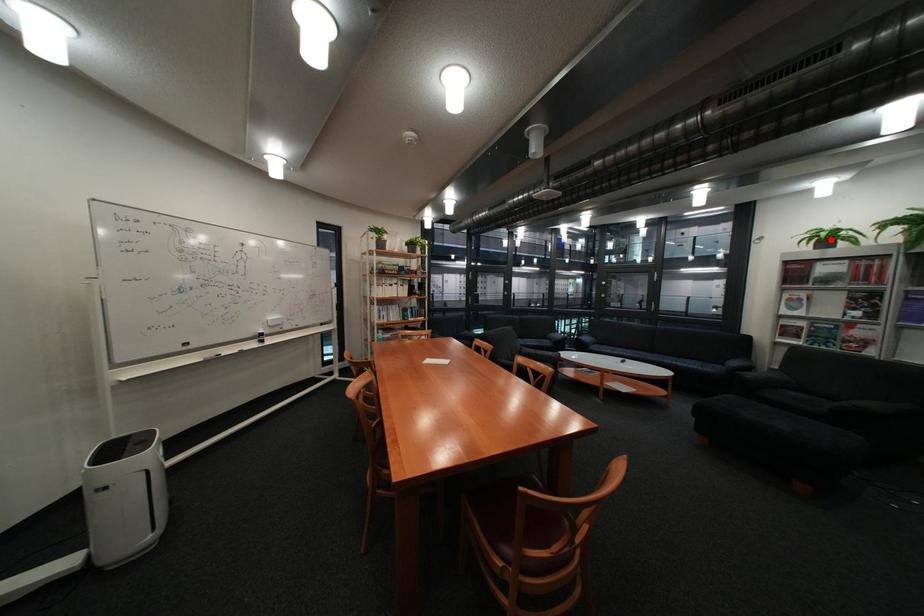
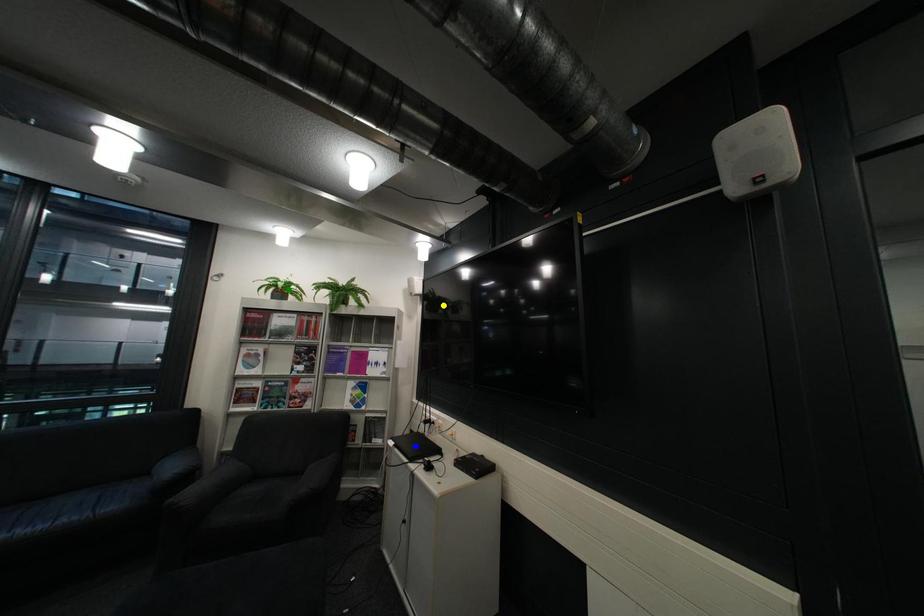
Question: I am providing you with two images of the same scene from different viewpoints. A red point is marked on the first image. You are given multiple points on the second image. Can you choose the point in image 2 that corresponds to the point in image 1?

Choices:
 (A) yellow point
 (B) blue point
 (C) green point

Answer: (C)